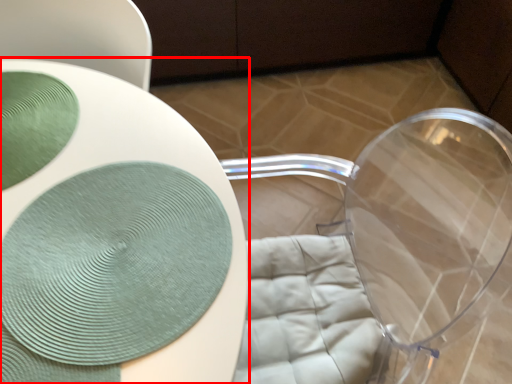
Question: Where is table (annotated by the red box) located in relation to glass plate in the image?

Choices:
 (A) left
 (B) right

Answer: (B)